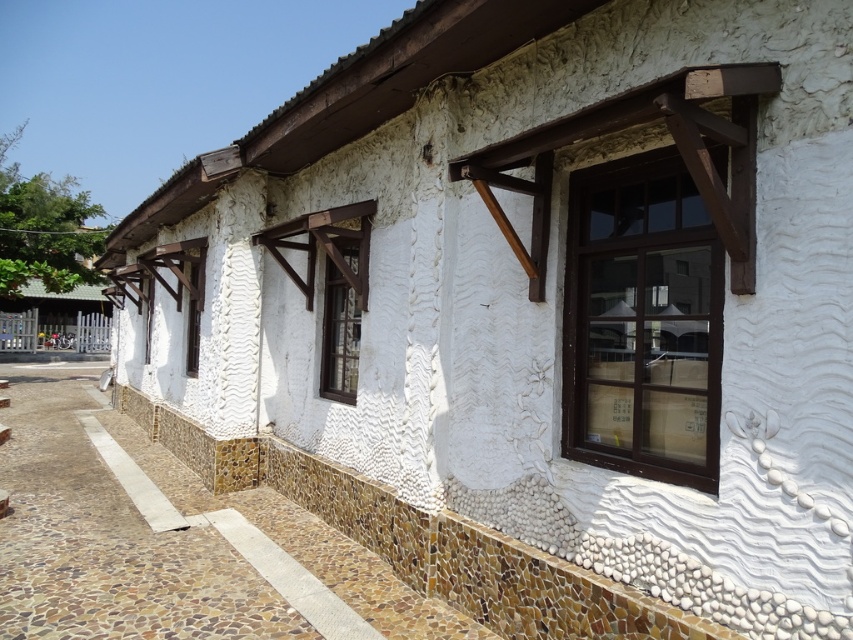
You are an architect reviewing a building design. You notice two windows at the center of the facade labeled as matte white window at center and white textured window at center. Which one has a larger size?

A: The white textured window at center has a larger size compared to the matte white window at center.

You are a delivery person trying to park your 4.5 meter long truck between the matte glass window at center and the matte white window at center. Can you fit your truck in that space?

The matte glass window at center and matte white window at center are 4.63 meters apart from each other. Since your truck is 4.5 meters long, it can fit in the space between them as there is enough room.